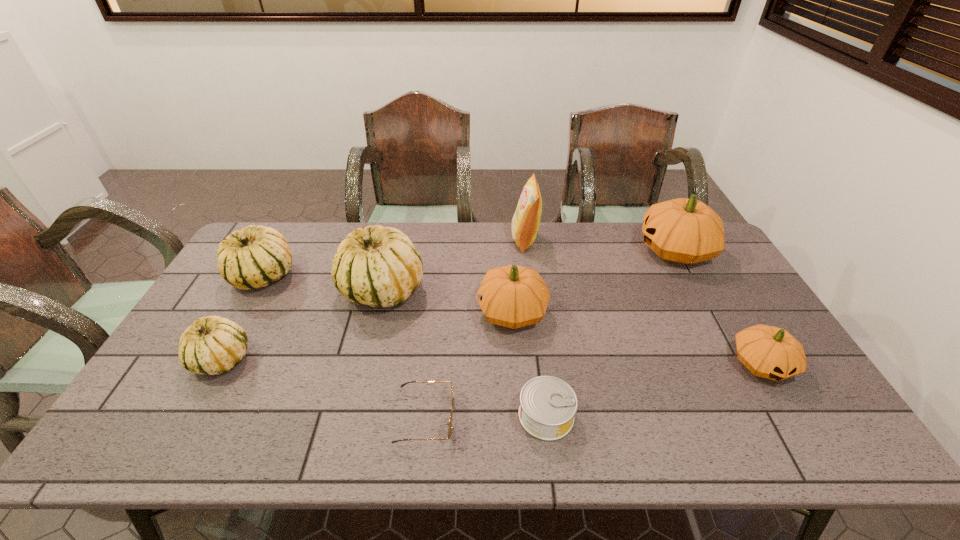
This screenshot has height=540, width=960. Find the location of `crisp (potato chip)`. crisp (potato chip) is located at coordinates (525, 223).

In order to click on the farthest orange gourd in this screenshot , I will do `click(686, 231)`.

At what (x,y) coordinates should I click in order to perform the action: click on the rightmost white gourd. Please return your answer as a coordinate pair (x, y). This screenshot has width=960, height=540. Looking at the image, I should click on (378, 266).

I want to click on the third gourd from left to right, so click(378, 266).

Where is `the second nearest orange gourd`? This screenshot has width=960, height=540. the second nearest orange gourd is located at coordinates (513, 296).

Where is `the leftmost orange gourd`? The width and height of the screenshot is (960, 540). the leftmost orange gourd is located at coordinates (513, 296).

Locate an element on the screen. the second smallest white gourd is located at coordinates (254, 257).

The width and height of the screenshot is (960, 540). I want to click on the smallest orange gourd, so click(x=770, y=352).

Where is `the smallest white gourd`? the smallest white gourd is located at coordinates (213, 345).

Find the location of a particular element. can is located at coordinates (548, 404).